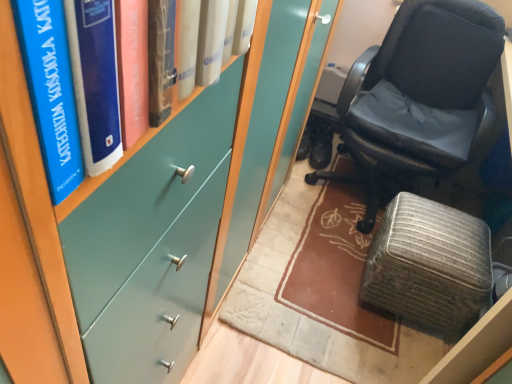
Question: Considering the positions of teal matte bookshelf at upper left and black leather chair at right in the image, is teal matte bookshelf at upper left taller or shorter than black leather chair at right?

Choices:
 (A) short
 (B) tall

Answer: (A)

Question: Is teal matte bookshelf at upper left in front of or behind black leather chair at right in the image?

Choices:
 (A) front
 (B) behind

Answer: (A)

Question: Estimate the real-world distances between objects in this image. Which object is farther from the black leather chair at right?

Choices:
 (A) black leather shoes at center
 (B) textured gray ottoman at lower right
 (C) teal matte bookshelf at upper left

Answer: (C)

Question: Considering the real-world distances, which object is closest to the textured gray ottoman at lower right?

Choices:
 (A) black leather shoes at center
 (B) teal matte bookshelf at upper left
 (C) black leather chair at right

Answer: (C)